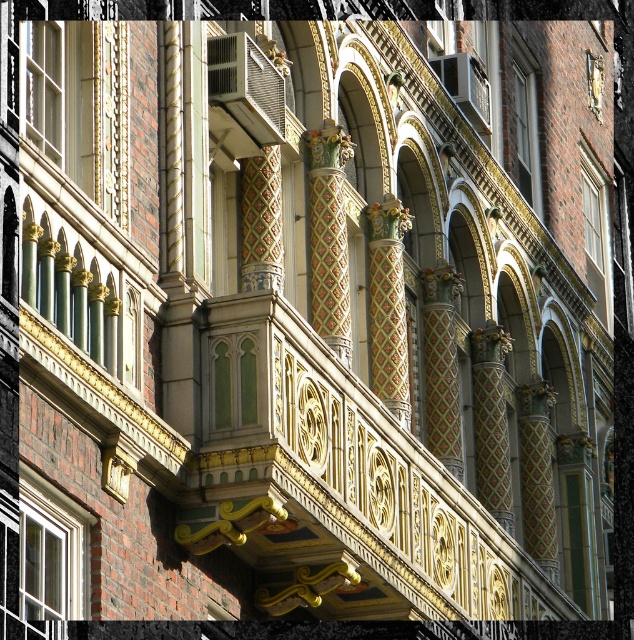
Question: Can you confirm if white glossy window at lower left is positioned above matte glass window at upper center?

Choices:
 (A) yes
 (B) no

Answer: (B)

Question: Which of the following is the closest to the observer?

Choices:
 (A) (30, 592)
 (B) (586, 172)

Answer: (A)

Question: Is matte glass window at upper left positioned behind white glossy window at lower left?

Choices:
 (A) no
 (B) yes

Answer: (B)

Question: Which object is positioned closest to the matte glass window at upper center?

Choices:
 (A) matte glass window at upper right
 (B) matte glass window at upper left
 (C) white painted wood window at upper right

Answer: (C)

Question: Which object appears farthest from the camera in this image?

Choices:
 (A) matte glass window at upper right
 (B) matte glass window at upper left

Answer: (A)

Question: Does matte glass window at upper left have a greater width compared to white painted wood window at upper right?

Choices:
 (A) no
 (B) yes

Answer: (A)